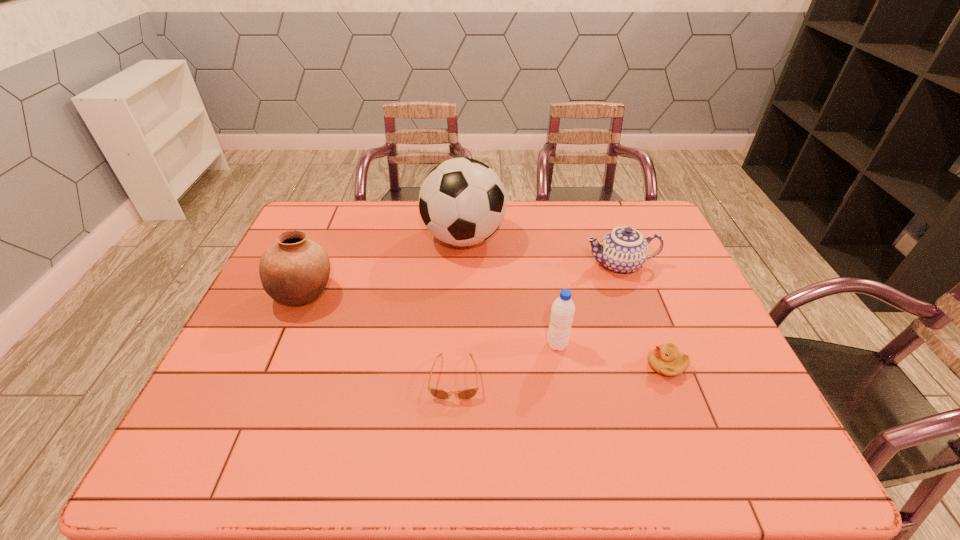
You are a GUI agent. You are given a task and a screenshot of the screen. Output one action in this format:
    pyautogui.click(x=<x>, y=<y>)
    Task: Click on the blank area at the far edge
    The image size is (960, 540).
    Given the screenshot: What is the action you would take?
    pyautogui.click(x=599, y=228)

Identify the location of blank area at the near edge. (315, 474).

In the image, there is a desktop. Identify the location of free space at the left edge. The height and width of the screenshot is (540, 960). (255, 323).

Identify the location of vacant area at the right edge of the desktop. Image resolution: width=960 pixels, height=540 pixels. (680, 259).

In the image, there is a desktop. Identify the location of free space at the far left corner. (341, 222).

At what (x,y) coordinates should I click in order to perform the action: click on free point at the far right corner. Please return your answer as a coordinate pair (x, y). Looking at the image, I should click on (630, 225).

Identify the location of vacant space that's between the tallest object and the water bottle. (511, 291).

Identify the location of vacant space that's between the pottery and the duckling. (486, 329).

Locate an element on the screen. Image resolution: width=960 pixels, height=540 pixels. vacant area that lies between the leftmost object and the chinaware is located at coordinates (462, 279).

The width and height of the screenshot is (960, 540). I want to click on empty space between the shortest object and the leftmost object, so click(380, 335).